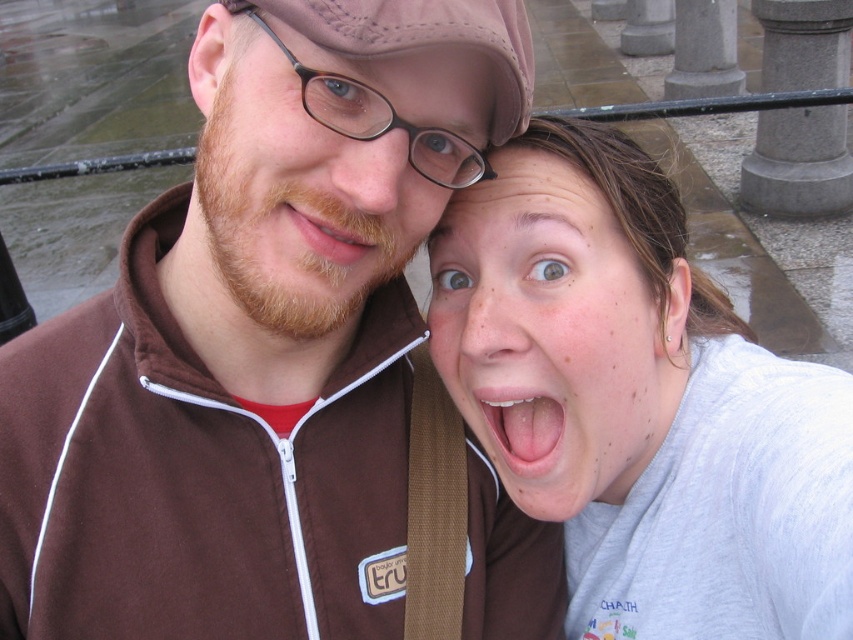
Question: Which of these objects is positioned closest to the matte brown jacket at upper left?

Choices:
 (A) brown suede jacket at center
 (B) pale skin at center

Answer: (A)

Question: Which object is positioned closest to the pink glossy lips at center?

Choices:
 (A) matte brown jacket at upper left
 (B) pale skin at center

Answer: (B)

Question: Which of these objects is positioned farthest from the pink glossy lips at center?

Choices:
 (A) matte brown jacket at upper left
 (B) matte gray shirt at center

Answer: (A)

Question: Does brown matte beard at center appear on the right side of pink glossy lips at center?

Choices:
 (A) yes
 (B) no

Answer: (B)

Question: Does matte brown jacket at upper left have a smaller size compared to pink glossy lips at center?

Choices:
 (A) no
 (B) yes

Answer: (A)

Question: Does brown suede jacket at center come behind pale skin at center?

Choices:
 (A) yes
 (B) no

Answer: (B)